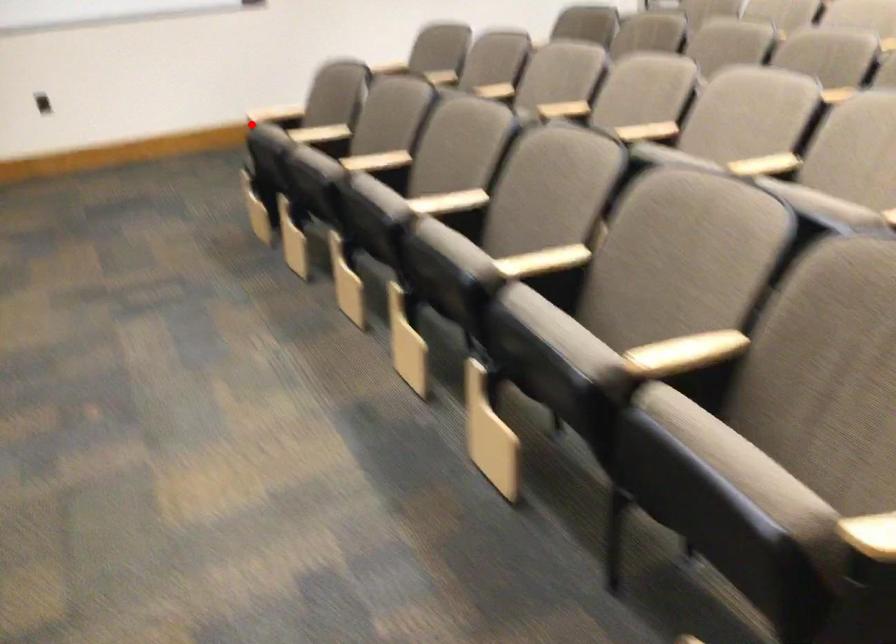
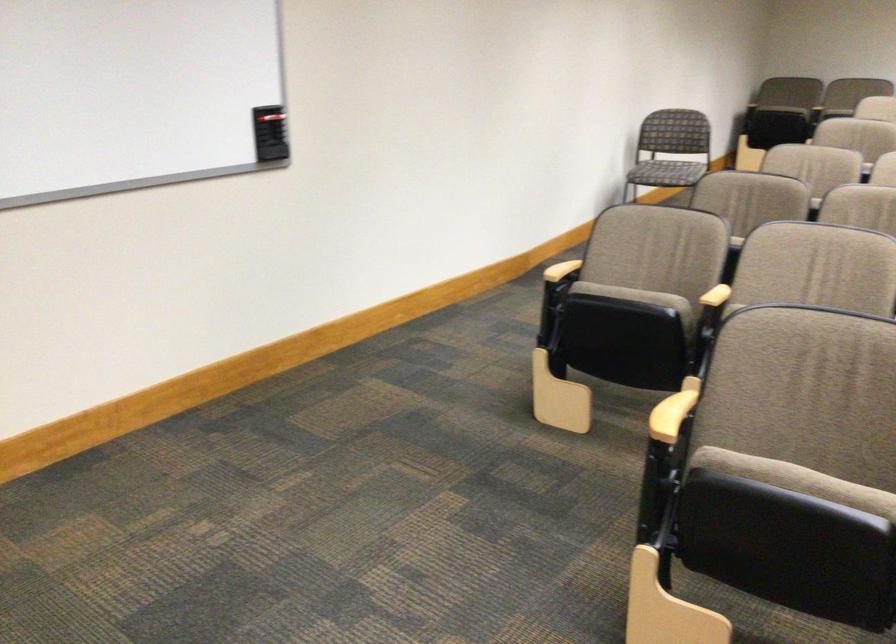
Question: I am providing you with two images of the same scene from different viewpoints. In image1, a red point is highlighted. Considering the same 3D point in image2, which of the following is correct?

Choices:
 (A) It is closer
 (B) It is farther

Answer: (A)